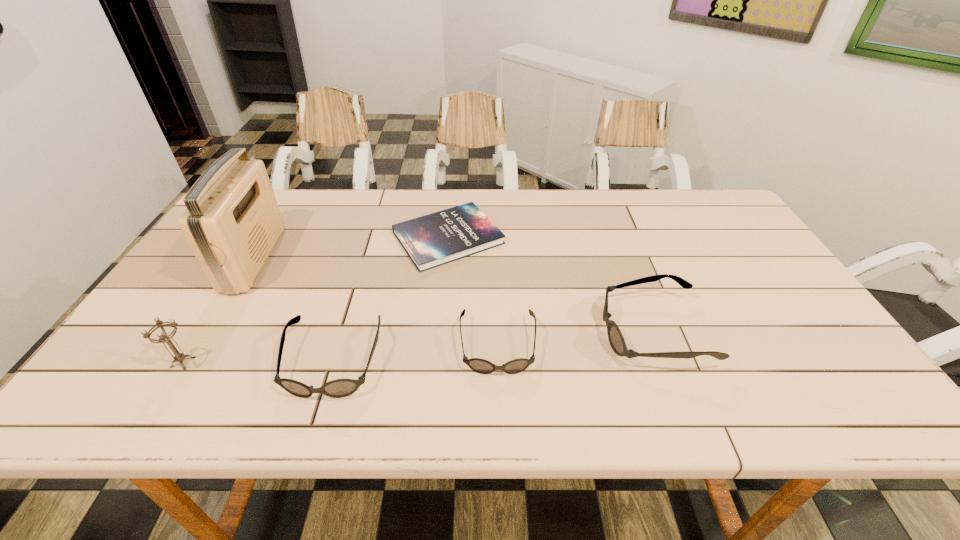
Locate an element on the screen. This screenshot has height=540, width=960. object that is at the near left corner is located at coordinates (163, 337).

In the image, there is a desktop. Where is `vacant space at the far edge`? The image size is (960, 540). vacant space at the far edge is located at coordinates (606, 199).

Find the location of a particular element. Image resolution: width=960 pixels, height=540 pixels. vacant area at the near edge of the desktop is located at coordinates (265, 365).

The image size is (960, 540). In the image, there is a desktop. What are the coordinates of `free space at the left edge` in the screenshot? It's located at (226, 295).

Locate an element on the screen. free space at the right edge of the desktop is located at coordinates (767, 284).

In the image, there is a desktop. In order to click on vacant space at the far right corner in this screenshot , I will do `click(725, 215)`.

Image resolution: width=960 pixels, height=540 pixels. I want to click on vacant space that is in between the fifth tallest object and the fourth tallest object, so pyautogui.click(x=416, y=354).

Locate an element on the screen. blank region between the leftmost sunglasses and the second sunglasses from left to right is located at coordinates (416, 354).

In order to click on empty location between the fourth tallest object and the fifth shortest object in this screenshot , I will do `click(258, 362)`.

Where is `free space between the fourth tallest object and the second tallest object`? The width and height of the screenshot is (960, 540). free space between the fourth tallest object and the second tallest object is located at coordinates (258, 362).